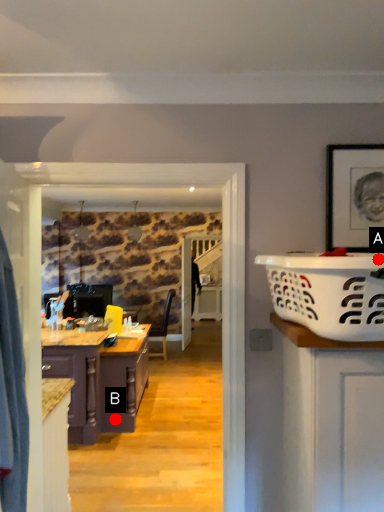
Question: Two points are circled on the image, labeled by A and B beside each circle. Which of the following is the farthest from the observer?

Choices:
 (A) A is further
 (B) B is further

Answer: (B)